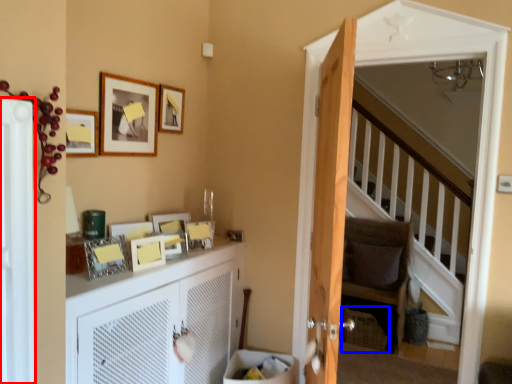
Question: Which object appears farthest to the camera in this image, screen door (highlighted by a red box) or basket (highlighted by a blue box)?

Choices:
 (A) screen door
 (B) basket

Answer: (B)